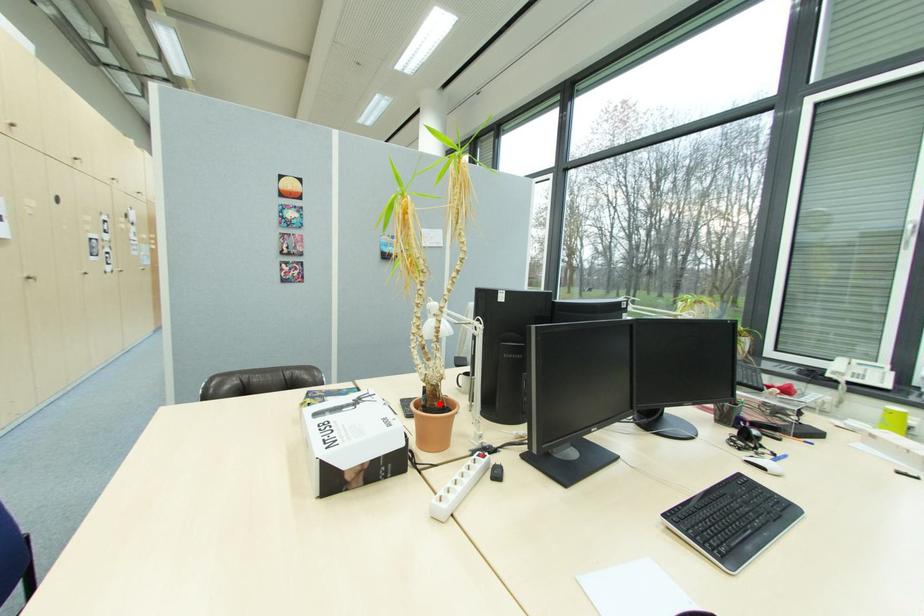
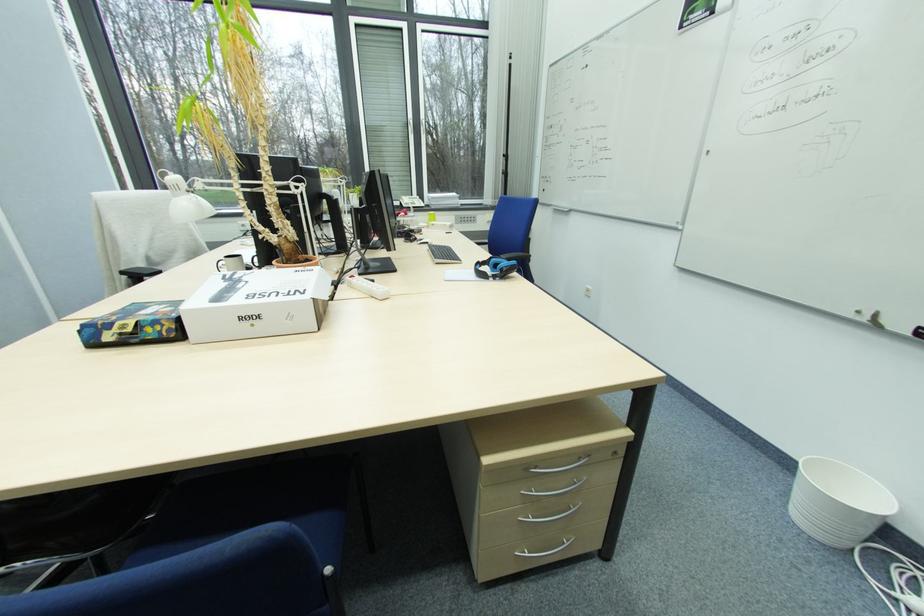
Locate, in the second image, the point that corresponds to the highlighted location in the first image.

(302, 257)